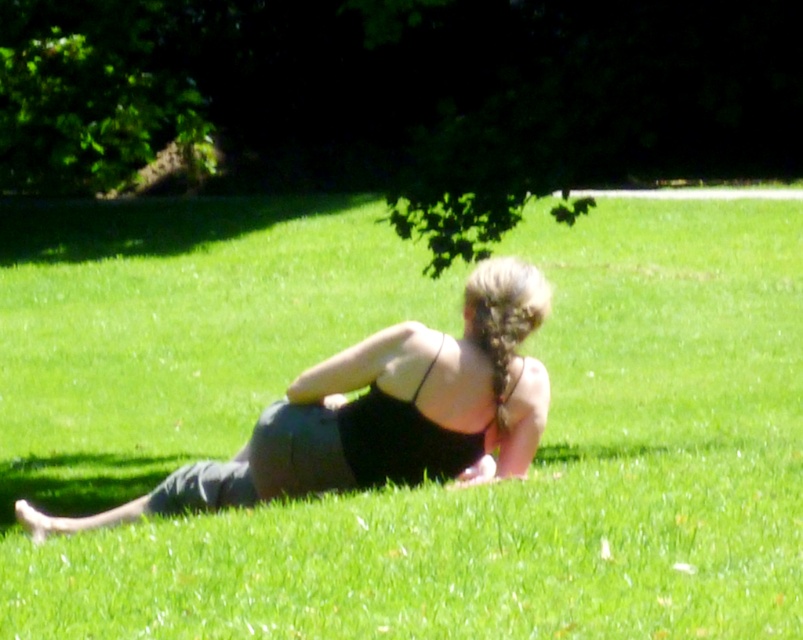
You are a photographer wanting to capture the shadow of the green leafy tree at upper center on the black fabric tank top at center. Based on the scene, is the tree casting its shadow over the tank top?

Yes, the green leafy tree at upper center is positioned over the black fabric tank top at center, so its shadow would be cast over the tank top.

You are standing in a park and see the green leafy tree at upper center. If you want to take a photo of it with your smartphone camera, which has a maximum zoom range of 10 meters, will you be able to capture the entire tree in the frame without moving closer?

The green leafy tree at upper center is 12.55 meters from camera, which is beyond the smartphone camera maximum zoom range of 10 meters. Therefore, you cannot capture the entire tree in the frame without moving closer.